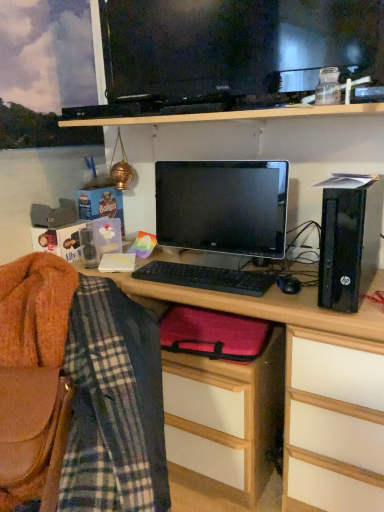
Describe the element at coordinates (288, 284) in the screenshot. I see `black plastic mouse at center` at that location.

Locate an element on the screen. The height and width of the screenshot is (512, 384). plaid fabric at left is located at coordinates (101, 413).

What is the approximate height of satin black monitor at center?

satin black monitor at center is 15.09 inches in height.

Locate an element on the screen. This screenshot has height=512, width=384. satin black monitor at center is located at coordinates (223, 206).

This screenshot has width=384, height=512. Describe the element at coordinates (206, 278) in the screenshot. I see `black matte keyboard at center` at that location.

Locate an element on the screen. Image resolution: width=384 pixels, height=512 pixels. black plastic mouse at center is located at coordinates coord(288,284).

Measure the distance between black glossy tv at upper center and satin black monitor at center.

black glossy tv at upper center is 15.27 inches from satin black monitor at center.

From the picture: Is black glossy tv at upper center behind satin black monitor at center?

No, the depth of black glossy tv at upper center is less than that of satin black monitor at center.

Which object is positioned more to the left, black glossy tv at upper center or satin black monitor at center?

black glossy tv at upper center.

Based on the photo, who is taller, black glossy tv at upper center or satin black monitor at center?

black glossy tv at upper center.

Based on the photo, can you see plaid fabric at left touching matte red laptop case at lower center?

plaid fabric at left is not next to matte red laptop case at lower center, and they're not touching.

Is plaid fabric at left further to camera compared to matte red laptop case at lower center?

No, plaid fabric at left is in front of matte red laptop case at lower center.

Is plaid fabric at left at the right side of matte red laptop case at lower center?

No, plaid fabric at left is not to the right of matte red laptop case at lower center.

From the image's perspective, is wooden desk at center over satin black monitor at center?

No, from the image's perspective, wooden desk at center is not on top of satin black monitor at center.

Locate an element on the screen. This screenshot has height=512, width=384. desk that is under the satin black monitor at center (from a real-world perspective) is located at coordinates (276, 313).

Which of these two, wooden desk at center or satin black monitor at center, is wider?

With larger width is wooden desk at center.

From a real-world perspective, which is physically below, wooden desk at center or satin black monitor at center?

From a 3D spatial view, wooden desk at center is below.

Is point (243, 284) positioned after point (246, 398)?

Yes, point (243, 284) is farther from viewer.

Which is in front, black matte keyboard at center or matte red laptop case at lower center?

Positioned in front is matte red laptop case at lower center.

Is matte red laptop case at lower center completely or partially inside black matte keyboard at center?

Definitely not — matte red laptop case at lower center is not inside black matte keyboard at center.

Is black matte keyboard at center bigger than matte red laptop case at lower center?

Incorrect, black matte keyboard at center is not larger than matte red laptop case at lower center.

From the image's perspective, who appears lower, black matte keyboard at center or black plastic computer tower at right?

black matte keyboard at center is shown below in the image.

The width and height of the screenshot is (384, 512). What are the coordinates of `computer tower located in front of the black matte keyboard at center` in the screenshot? It's located at (349, 239).

In the scene shown: Is black matte keyboard at center not within black plastic computer tower at right?

Absolutely, black matte keyboard at center is external to black plastic computer tower at right.

Is black matte keyboard at center smaller than black plastic computer tower at right?

Yes.

From a real-world perspective, who is located lower, black plastic mouse at center or black matte keyboard at center?

black matte keyboard at center.

Is black plastic mouse at center situated inside black matte keyboard at center or outside?

black plastic mouse at center is spatially situated outside black matte keyboard at center.

Is point (282, 276) less distant than point (199, 269)?

Yes, point (282, 276) is closer to viewer.

Measure the distance from satin black monitor at center to wooden desk at center.

satin black monitor at center and wooden desk at center are 8.03 inches apart.

Is satin black monitor at center next to wooden desk at center?

No, satin black monitor at center is not touching wooden desk at center.

Is satin black monitor at center turned away from wooden desk at center?

No, wooden desk at center is not at the back of satin black monitor at center.

Considering the sizes of objects satin black monitor at center and wooden desk at center in the image provided, who is taller, satin black monitor at center or wooden desk at center?

wooden desk at center is taller.

The width and height of the screenshot is (384, 512). In order to click on computer monitor on the right of black glossy tv at upper center in this screenshot , I will do `click(223, 206)`.

The width and height of the screenshot is (384, 512). Identify the location of file cabinet behind the plaid fabric at left. (224, 419).

From the image, which object appears to be nearer to wooden desk at center, satin black monitor at center or black glossy tv at upper center?

The object closer to wooden desk at center is satin black monitor at center.

Based on their spatial positions, is black glossy tv at upper center or matte red laptop case at lower center closer to wooden desk at center?

Among the two, matte red laptop case at lower center is located nearer to wooden desk at center.

Looking at the image, which one is located further to black matte keyboard at center, black plastic computer tower at right or matte red laptop case at lower center?

matte red laptop case at lower center is further to black matte keyboard at center.

When comparing their distances from black glossy tv at upper center, does black matte keyboard at center or black plastic mouse at center seem further?

The object further to black glossy tv at upper center is black plastic mouse at center.

Considering their positions, is plaid fabric at left positioned further to black plastic computer tower at right than black matte keyboard at center?

plaid fabric at left is further to black plastic computer tower at right.

Estimate the real-world distances between objects in this image. Which object is further from black matte keyboard at center, plaid fabric at left or matte red laptop case at lower center?

plaid fabric at left is further to black matte keyboard at center.

Looking at the image, which one is located closer to black plastic mouse at center, satin black monitor at center or black glossy tv at upper center?

satin black monitor at center lies closer to black plastic mouse at center than the other object.

Which object lies further to the anchor point black matte keyboard at center, wooden desk at center or black plastic mouse at center?

The object further to black matte keyboard at center is black plastic mouse at center.

Locate an element on the screen. computer tower that lies between black glossy tv at upper center and matte red laptop case at lower center from top to bottom is located at coordinates (349, 239).

The height and width of the screenshot is (512, 384). In order to click on computer monitor located between black matte keyboard at center and black plastic mouse at center in the left-right direction in this screenshot , I will do `click(223, 206)`.

This screenshot has height=512, width=384. In order to click on computer tower that lies between satin black monitor at center and wooden desk at center from top to bottom in this screenshot , I will do pyautogui.click(x=349, y=239).

The image size is (384, 512). Find the location of `plaid that lies between black glossy tv at upper center and matte red laptop case at lower center from top to bottom`. plaid that lies between black glossy tv at upper center and matte red laptop case at lower center from top to bottom is located at coordinates (101, 413).